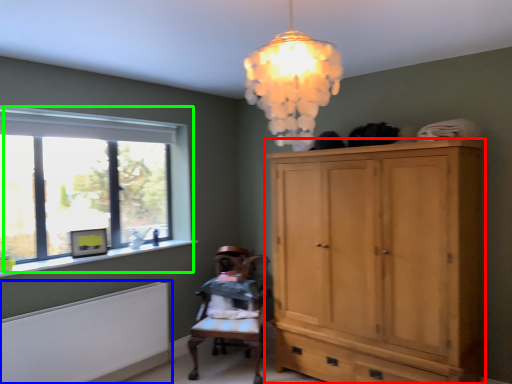
Question: Based on their relative distances, which object is nearer to cabinetry (highlighted by a red box)? Choose from radiator (highlighted by a blue box) and window (highlighted by a green box).

Choices:
 (A) radiator
 (B) window

Answer: (A)